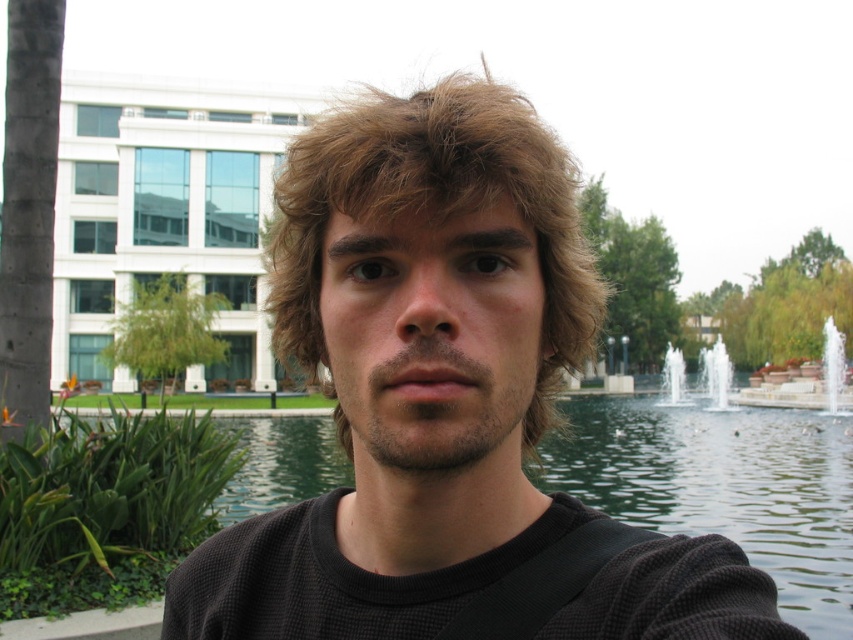
Find the location of a particular element. The height and width of the screenshot is (640, 853). white glossy water at center is located at coordinates (717, 374).

Can you confirm if white glossy water at center is bigger than clear glass water at center?

Yes, white glossy water at center is bigger than clear glass water at center.

Is point (677, 381) farther from camera compared to point (729, 385)?

Yes, point (677, 381) is behind point (729, 385).

Image resolution: width=853 pixels, height=640 pixels. In order to click on white glossy water at center in this screenshot , I will do `click(717, 374)`.

Which is above, clear glass water at center or white stone fountain at center?

clear glass water at center is higher up.

Is clear glass water at center shorter than white stone fountain at center?

Indeed, clear glass water at center has a lesser height compared to white stone fountain at center.

Which is behind, point (712, 404) or point (679, 355)?

Positioned behind is point (679, 355).

Where is `clear glass water at center`? clear glass water at center is located at coordinates (717, 374).

Which of these two, green water at center or white stone fountain at center, stands shorter?

With less height is green water at center.

Is green water at center smaller than white stone fountain at center?

No.

What do you see at coordinates (723, 486) in the screenshot? I see `green water at center` at bounding box center [723, 486].

Identify the location of green water at center. The height and width of the screenshot is (640, 853). (723, 486).